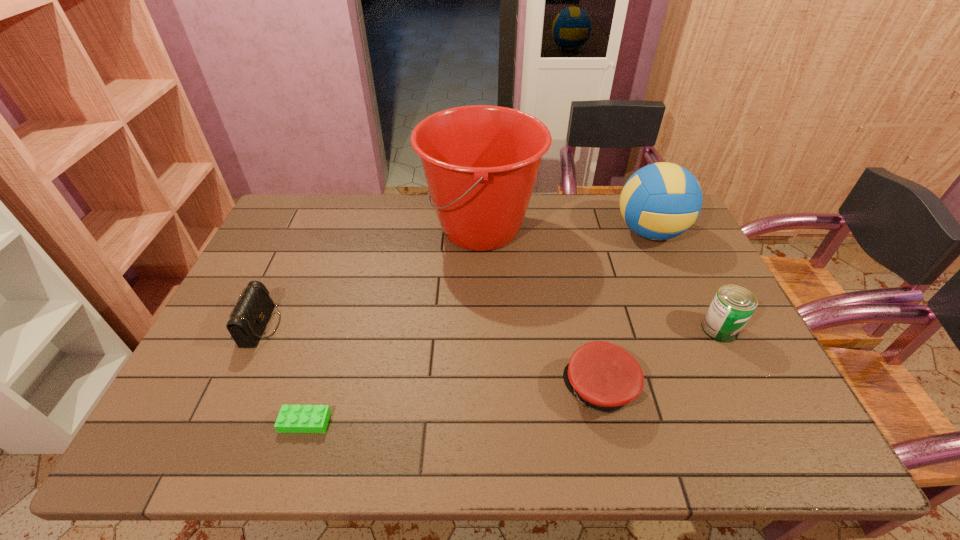
Where is `free space at the far left corner of the desktop`? The image size is (960, 540). free space at the far left corner of the desktop is located at coordinates (327, 205).

In the image, there is a desktop. Where is `vacant area at the near right corner`? The height and width of the screenshot is (540, 960). vacant area at the near right corner is located at coordinates (737, 449).

The height and width of the screenshot is (540, 960). Identify the location of free space between the bucket and the can. tap(600, 279).

Locate an element on the screen. The image size is (960, 540). empty space between the fourth tallest object and the can is located at coordinates (491, 327).

Find the location of a particular element. The width and height of the screenshot is (960, 540). vacant space that is in between the cap and the Lego is located at coordinates (452, 405).

You are a GUI agent. You are given a task and a screenshot of the screen. Output one action in this format:
    pyautogui.click(x=<x>, y=<y>)
    Task: Click on the free point between the Lego and the cap
    
    Given the screenshot: What is the action you would take?
    coord(452,405)

Identify the location of free spot between the bucket and the cap. The height and width of the screenshot is (540, 960). (540, 309).

Locate an element on the screen. empty space that is in between the shortest object and the cap is located at coordinates (452, 405).

Locate an element on the screen. free space between the leftmost object and the tallest object is located at coordinates click(372, 277).

The width and height of the screenshot is (960, 540). Identify the location of vacant space that is in between the cap and the volleyball. (625, 310).